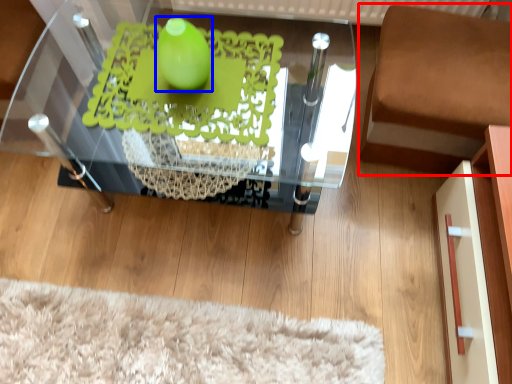
Question: Which object is closer to the camera taking this photo, furniture (highlighted by a red box) or lime (highlighted by a blue box)?

Choices:
 (A) furniture
 (B) lime

Answer: (B)